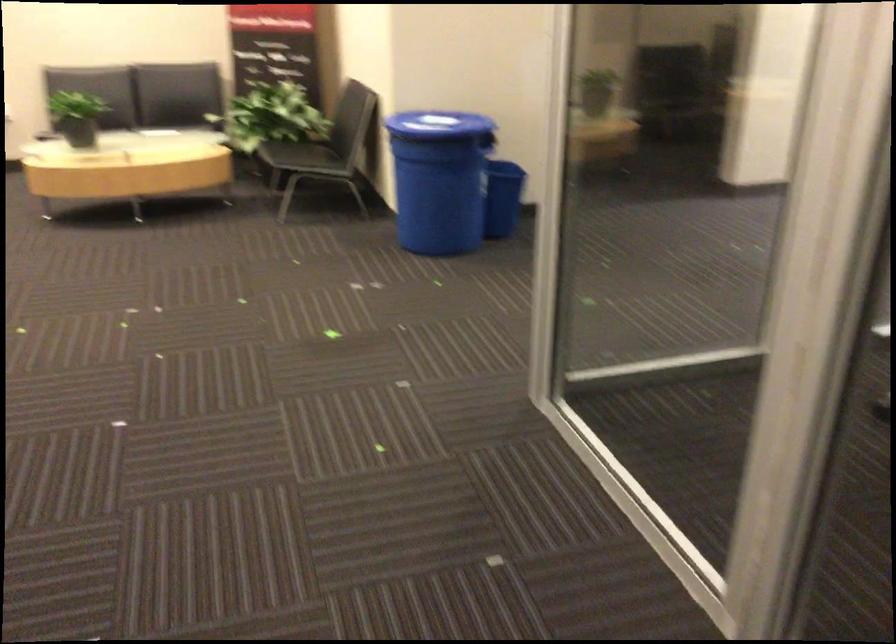
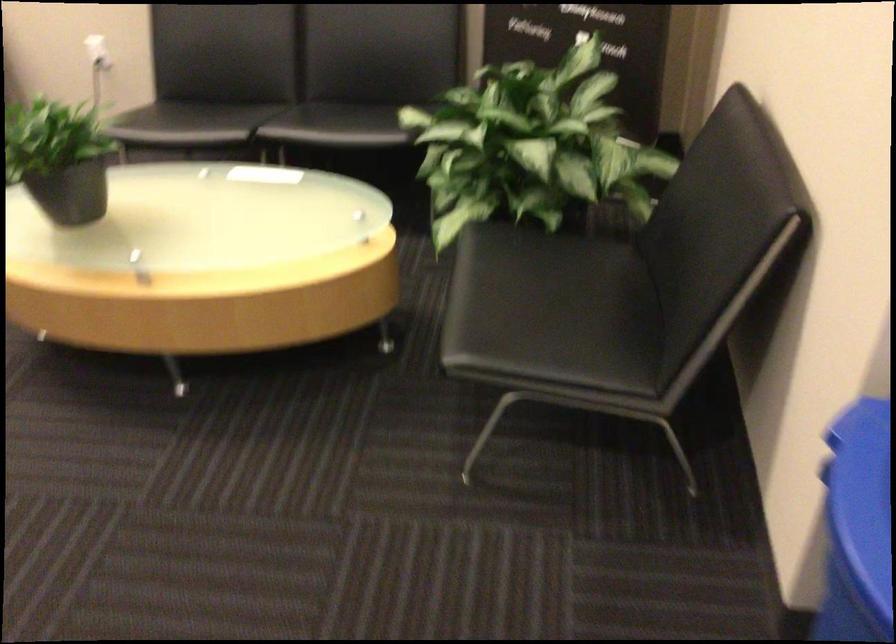
Question: In a continuous first-person perspective shot, in which direction is the camera moving?

Choices:
 (A) Left
 (B) Right
 (C) Forward
 (D) Backward

Answer: (C)